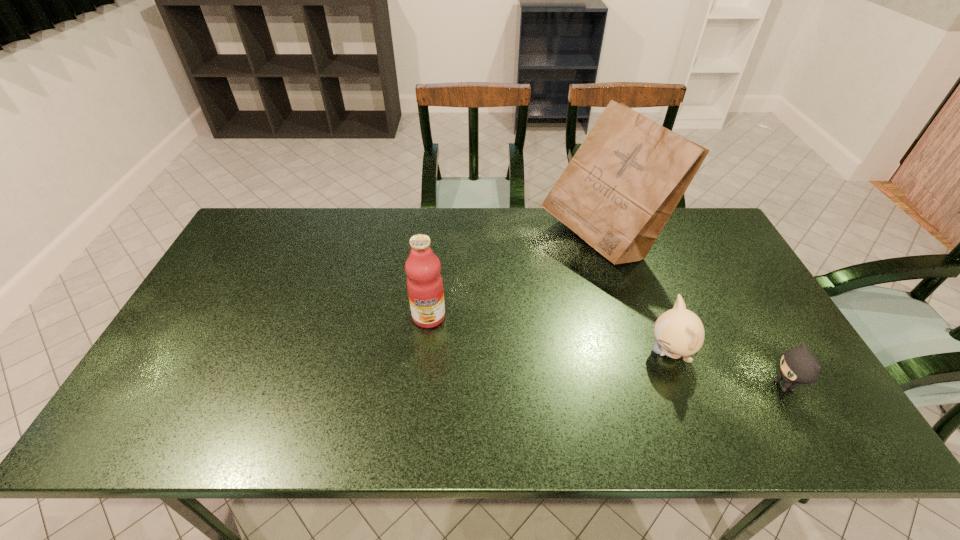
What are the coordinates of `vacant space situated 0.180m on the face of the taller kitten` in the screenshot? It's located at (578, 352).

Locate an element on the screen. Image resolution: width=960 pixels, height=540 pixels. vacant space located 0.080m on the face of the taller kitten is located at coordinates (616, 352).

Image resolution: width=960 pixels, height=540 pixels. Identify the location of free location located 0.290m on the face of the taller kitten. (535, 352).

I want to click on vacant area located 0.140m on the front-facing side of the shortest object, so click(x=711, y=386).

Locate an element on the screen. free location located on the front-facing side of the shortest object is located at coordinates click(628, 386).

Image resolution: width=960 pixels, height=540 pixels. I want to click on free spot located 0.230m on the front-facing side of the shortest object, so click(x=674, y=386).

You are a GUI agent. You are given a task and a screenshot of the screen. Output one action in this format:
    pyautogui.click(x=<x>, y=<y>)
    Task: Click on the object present at the far edge
    This screenshot has width=960, height=540.
    Given the screenshot: What is the action you would take?
    pyautogui.click(x=617, y=193)

Where is `object at the near edge`? This screenshot has width=960, height=540. object at the near edge is located at coordinates (798, 366).

Where is `object that is at the right edge`? The width and height of the screenshot is (960, 540). object that is at the right edge is located at coordinates (798, 366).

Identify the location of object that is at the near right corner. (798, 366).